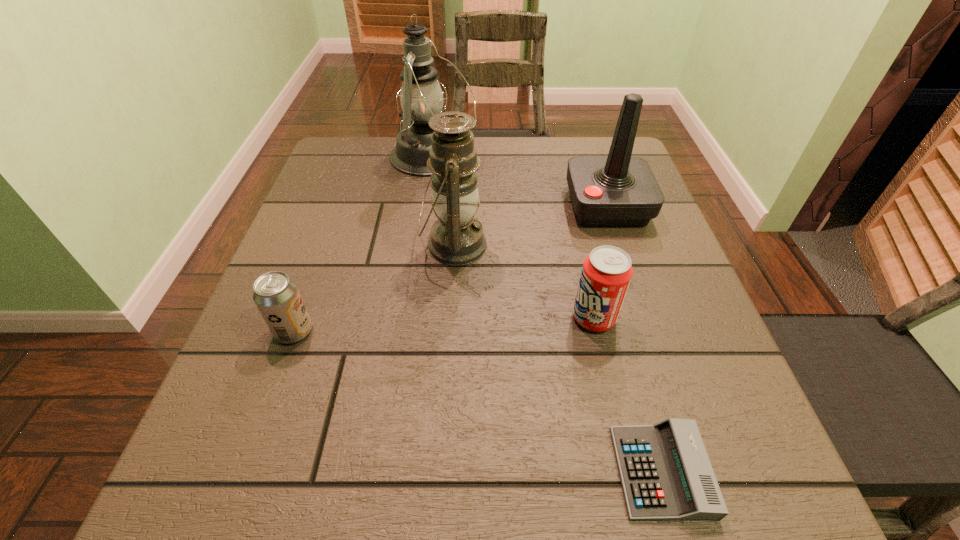
In order to click on unoccupied position between the beer can and the farthest object in this screenshot , I will do `click(364, 244)`.

The image size is (960, 540). Find the location of `free space between the joystick and the leftmost object`. free space between the joystick and the leftmost object is located at coordinates (450, 268).

Find the location of a particular element. Image resolution: width=960 pixels, height=540 pixels. free area in between the shortest object and the beer can is located at coordinates (477, 401).

Find the location of a particular element. The width and height of the screenshot is (960, 540). empty space between the fourth tallest object and the nearest object is located at coordinates (628, 395).

Locate an element on the screen. free space between the nearer oil lamp and the calculator is located at coordinates (558, 359).

Image resolution: width=960 pixels, height=540 pixels. What are the coordinates of `unoccupied area between the soda can and the shortest object` in the screenshot? It's located at (628, 395).

Where is `vacant space that's between the nearest object and the leftmost object`? vacant space that's between the nearest object and the leftmost object is located at coordinates (477, 401).

Find the location of a particular element. This screenshot has width=960, height=540. vacant point located between the nearest object and the third shortest object is located at coordinates click(x=628, y=395).

You are a GUI agent. You are given a task and a screenshot of the screen. Output one action in this format:
    pyautogui.click(x=<x>, y=<y>)
    Task: Click on the free space between the nearest object and the third shortest object
    
    Given the screenshot: What is the action you would take?
    pyautogui.click(x=628, y=395)

The width and height of the screenshot is (960, 540). I want to click on object that ranks as the second closest to the second shortest object, so click(421, 97).